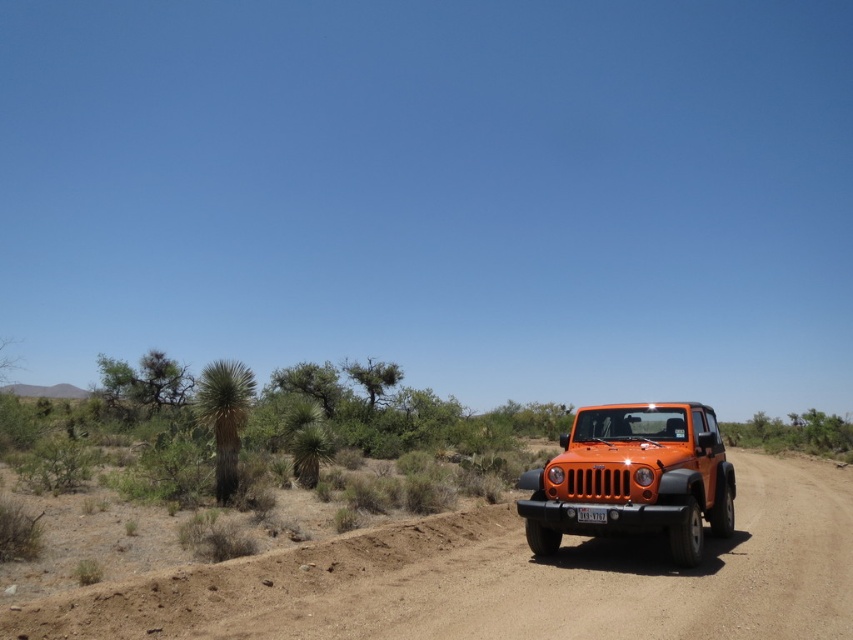
You are a hiker lost in the desert and see the dirt track at center and the orange matte jeep at center. Which direction should you follow to reach the jeep?

The dirt track at center is positioned under the orange matte jeep at center, so following the dirt track at center towards the direction the jeep is facing would lead you towards the orange matte jeep at center.

You are driving an orange matte jeep at center on a dirt track at center. Can the jeep drive along the track without any part of it hanging off the edge?

The dirt track at center is wider than the orange matte jeep at center, so the jeep can drive along the track without any part hanging off the edge.